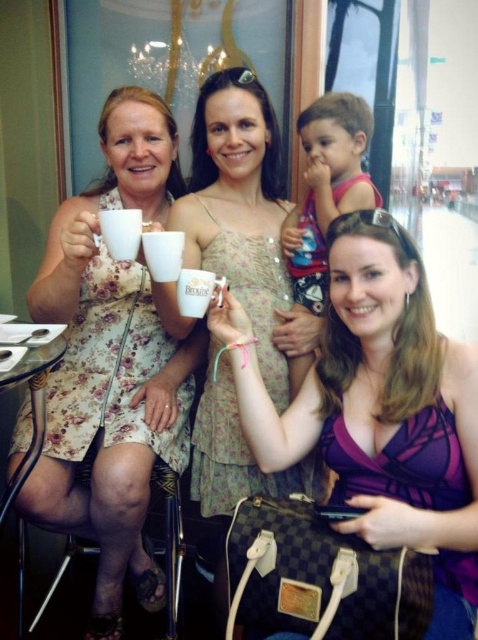
You are a photographer standing at the entrance of the cafe. You want to take a photo of the purple fabric dress at center. If your camera can focus on objects within 40 inches, will the dress be in focus?

The purple fabric dress at center is 38.36 inches away from the viewer, which is within the camera focus range of 40 inches. Therefore, the dress will be in focus.

You are sitting at a table in a cafe. You see two points marked in the scene. One is at coordinates point (370,522) and the other at point (170,236). Which point is closer to you?

Point (370,522) is in front of point (170,236), so it is closer to you.

You are taking a photo of the scene and want to focus on both point (390, 472) and point (129, 209). Which point should you focus on first to ensure both are in focus?

You should focus on point (390, 472) first because it is closer to the camera than point (129, 209), ensuring both points are within the depth of field.